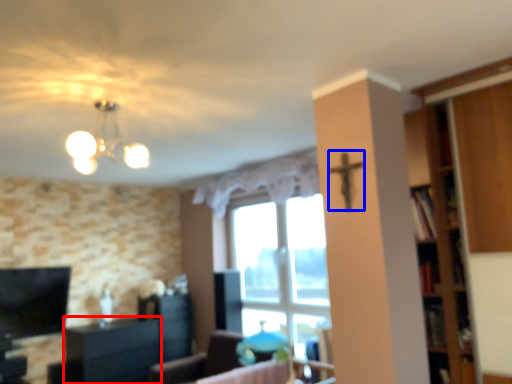
Question: Which point is closer to the camera, cabinetry (highlighted by a red box) or crucifix (highlighted by a blue box)?

Choices:
 (A) cabinetry
 (B) crucifix

Answer: (B)